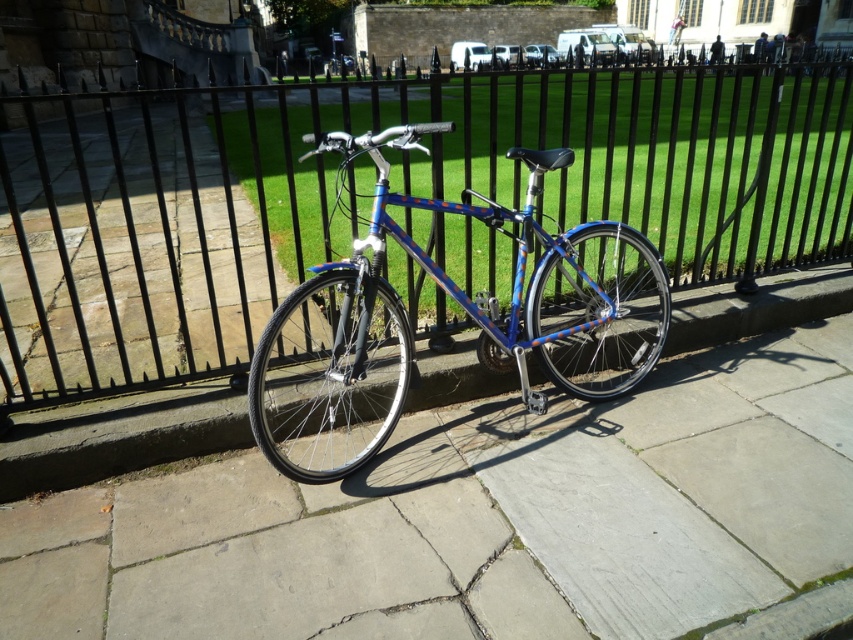
You are a delivery person who needs to move a 1.2 meter wide box from the gray concrete pavement at center to the black metal fence at center. Can the box fit through the space between them?

The gray concrete pavement at center is narrower than the black metal fence at center. Since the box is 1.2 meters wide, it may not fit through the space between them if the available width is less than 1.2 meters. Check the exact width before moving the box.

You are planning to move the blue metallic bicycle at center to a different location. If you lift it straight up from its current position, will the gray concrete pavement at center be visible underneath the bicycle?

The gray concrete pavement at center is shorter than the blue metallic bicycle at center, so when lifted, the pavement will be visible underneath the bicycle since it is lower than the bicycle.